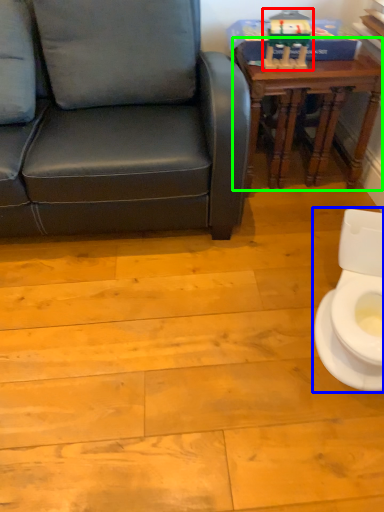
Question: Considering the real-world distances, which object is farthest from toy (highlighted by a red box)? toilet (highlighted by a blue box) or table (highlighted by a green box)?

Choices:
 (A) toilet
 (B) table

Answer: (A)